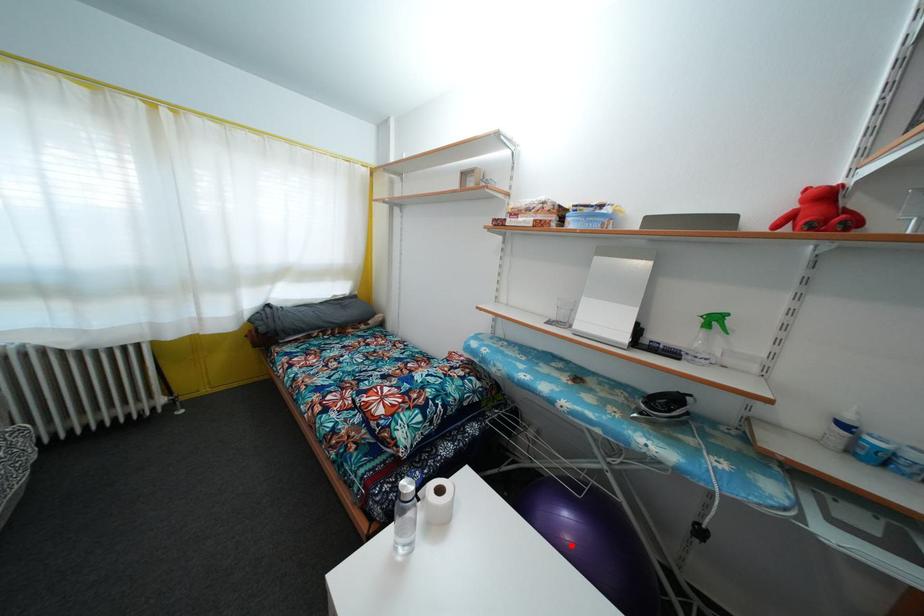
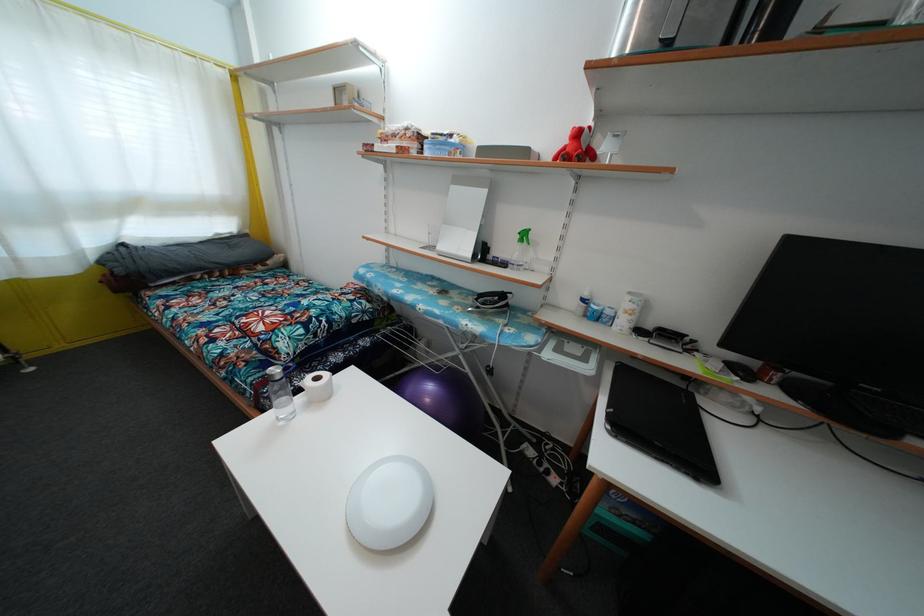
In the second image, find the point that corresponds to the highlighted location in the first image.

(431, 407)